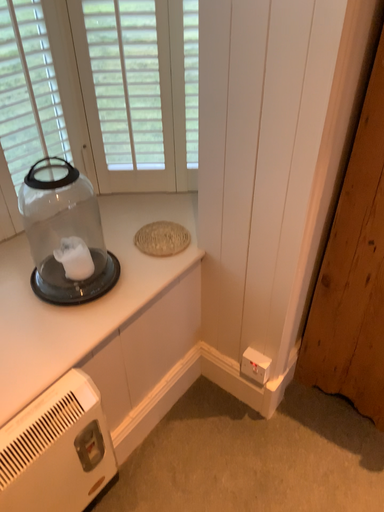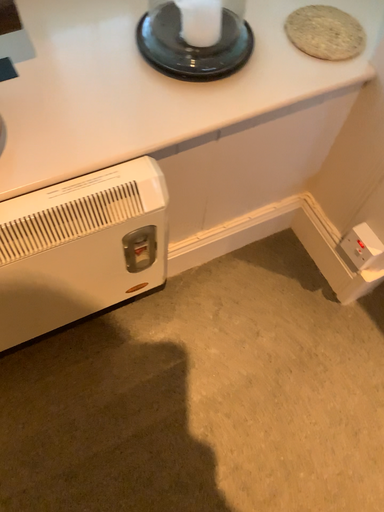
Question: Which way did the camera rotate in the video?

Choices:
 (A) rotated right
 (B) rotated left

Answer: (B)